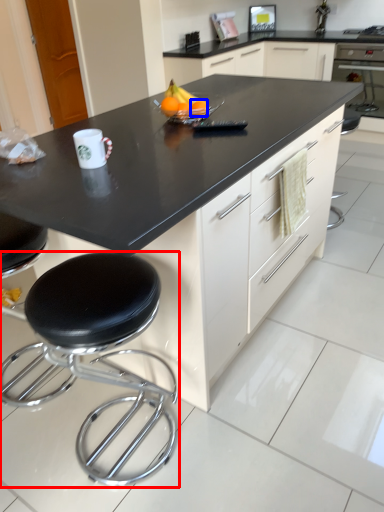
Question: Which of the following is the closest to the observer, stool (highlighted by a red box) or orange (highlighted by a blue box)?

Choices:
 (A) stool
 (B) orange

Answer: (A)